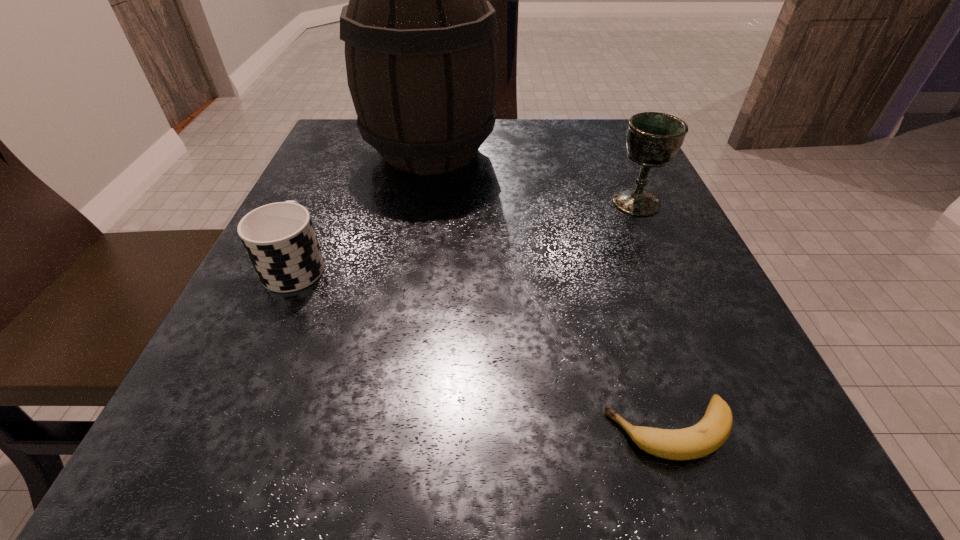
Where is `wine bucket`? The height and width of the screenshot is (540, 960). wine bucket is located at coordinates pyautogui.click(x=421, y=58).

Find the location of `the farthest object`. the farthest object is located at coordinates (421, 58).

This screenshot has height=540, width=960. I want to click on chalice, so click(652, 139).

What are the coordinates of `the second farthest object` in the screenshot? It's located at (652, 139).

Where is `the third tallest object`? This screenshot has width=960, height=540. the third tallest object is located at coordinates (279, 238).

The image size is (960, 540). I want to click on the third farthest object, so click(279, 238).

The width and height of the screenshot is (960, 540). Find the location of `banana`. banana is located at coordinates (710, 433).

In order to click on the nearest object in this screenshot , I will do `click(710, 433)`.

Find the location of `vacant space positioned on the left of the farthest object`. vacant space positioned on the left of the farthest object is located at coordinates (336, 151).

This screenshot has height=540, width=960. I want to click on free space located 0.050m on the left of the third shortest object, so coord(584,202).